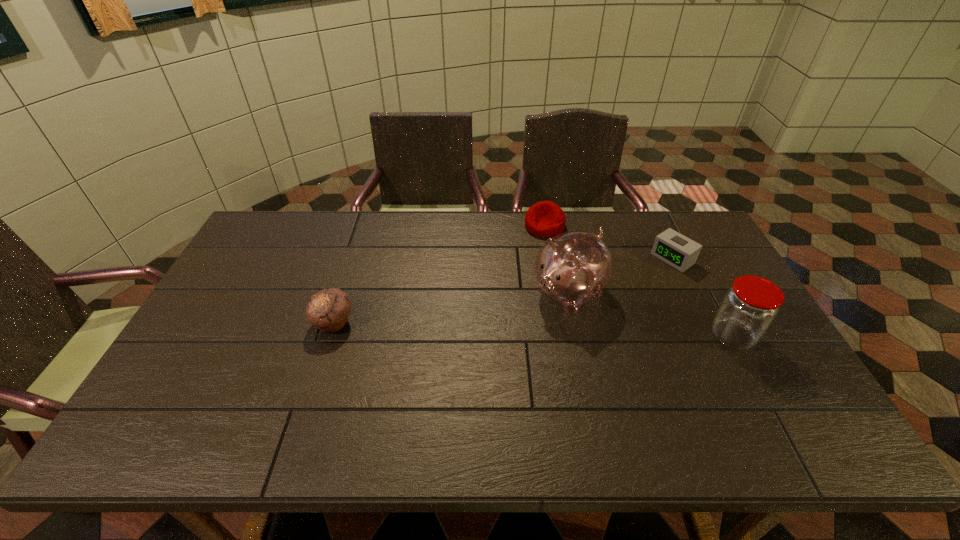
In order to click on vacant space located 0.140m on the seat area of the farthest object in this screenshot , I will do coord(528,262).

Find the location of a particular element. Image resolution: width=960 pixels, height=540 pixels. free space located 0.250m on the front facing side of the piggy bank is located at coordinates (475, 353).

Where is `vacant space located on the front facing side of the piggy bank`? vacant space located on the front facing side of the piggy bank is located at coordinates (481, 349).

Locate an element on the screen. This screenshot has width=960, height=540. vacant area located on the front facing side of the piggy bank is located at coordinates (498, 338).

The width and height of the screenshot is (960, 540). Identify the location of vacant space located 0.350m on the front-facing side of the alarm clock. (588, 318).

Find the location of a particular element. Image resolution: width=960 pixels, height=540 pixels. vacant region located 0.130m on the front-facing side of the alarm clock is located at coordinates (636, 285).

Find the location of a particular element. blank area located on the front-facing side of the alarm clock is located at coordinates (617, 298).

This screenshot has width=960, height=540. I want to click on beanbag located in the far edge section of the desktop, so click(544, 219).

The image size is (960, 540). What are the coordinates of `alarm clock situated at the far edge` in the screenshot? It's located at (675, 249).

Locate an element on the screen. The image size is (960, 540). jar that is at the right edge is located at coordinates (748, 309).